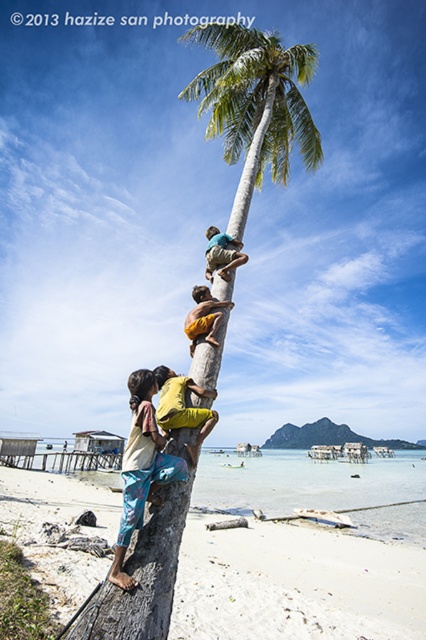
Is point (150, 388) positioned before point (186, 332)?

Yes.

Who is taller, blue printed pants at lower left or yellow fabric at center?

Standing taller between the two is blue printed pants at lower left.

Does point (118, 561) come closer to viewer compared to point (184, 326)?

Yes, point (118, 561) is in front of point (184, 326).

Locate an element on the screen. The width and height of the screenshot is (426, 640). blue printed pants at lower left is located at coordinates (141, 468).

Between point (146, 445) and point (222, 250), which one is positioned in front?

Point (146, 445) is more forward.

Can you confirm if blue printed pants at lower left is bigger than light brown wooden pole at upper center?

Actually, blue printed pants at lower left might be smaller than light brown wooden pole at upper center.

The image size is (426, 640). I want to click on blue printed pants at lower left, so click(141, 468).

From the picture: Does yellow fabric shirt at center appear on the left side of yellow fabric at center?

Correct, you'll find yellow fabric shirt at center to the left of yellow fabric at center.

Which is behind, point (187, 449) or point (195, 320)?

Positioned behind is point (195, 320).

Where is `yellow fabric shirt at center`? Image resolution: width=426 pixels, height=640 pixels. yellow fabric shirt at center is located at coordinates (183, 406).